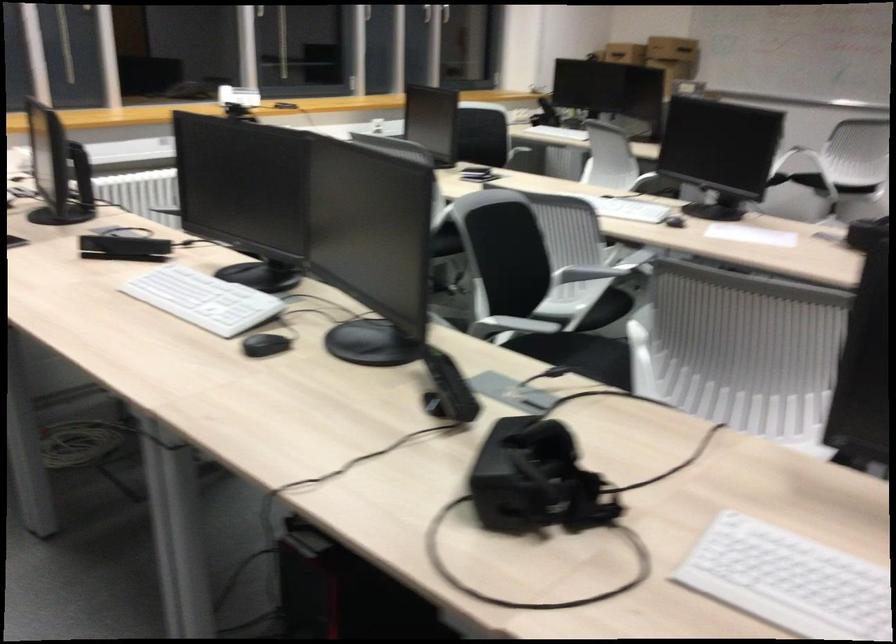
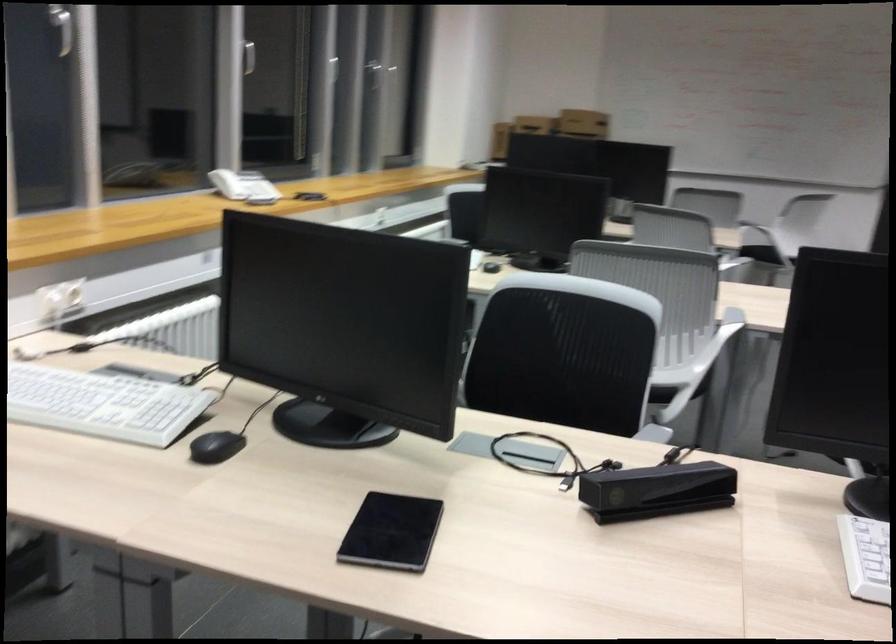
The point at (229, 99) is marked in the first image. Where is the corresponding point in the second image?

(227, 184)